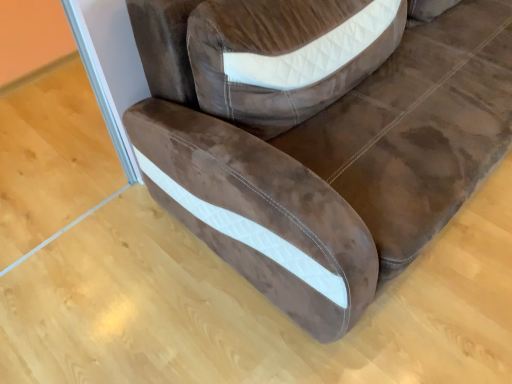
Measure the distance between point [269,159] and camera.

They are 1.11 meters apart.

Where is `brown leather couch at center`? The width and height of the screenshot is (512, 384). brown leather couch at center is located at coordinates (327, 150).

The height and width of the screenshot is (384, 512). Describe the element at coordinates (327, 150) in the screenshot. I see `brown leather couch at center` at that location.

Find the location of a particular element. Image resolution: width=512 pixels, height=384 pixels. brown leather couch at center is located at coordinates (327, 150).